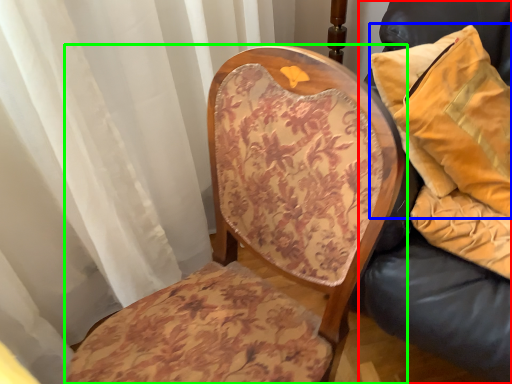
Question: Based on their relative distances, which object is farther from furniture (highlighted by a red box)? Choose from pillow (highlighted by a blue box) and chair (highlighted by a green box).

Choices:
 (A) pillow
 (B) chair

Answer: (B)